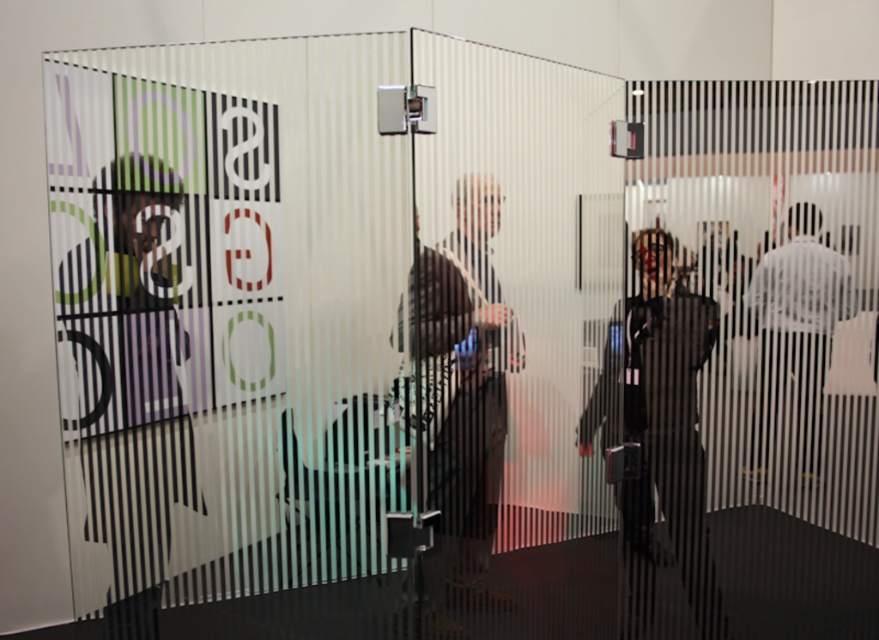
Based on the coordinates provided, which object corresponds to the point located at [133,376] in the scene?

The point at [133,376] corresponds to the matte black shirt at left.

You are a delivery person who needs to place a matte black laptop at center on a desk that is 1.2 meters wide. The desk is positioned such that its left edge is at point 0.4 meters from the left side of the image. Can the laptop fit on the desk without overlapping the edges?

The matte black laptop at center is located at point (461, 385). Since the desk is 1.2 meters wide and its left edge is at 0.4 meters from the left side, the desk spans from 0.4 to 1.6 meters. The laptop at 0.603 meters falls within this range, so it can fit on the desk without overlapping the edges.